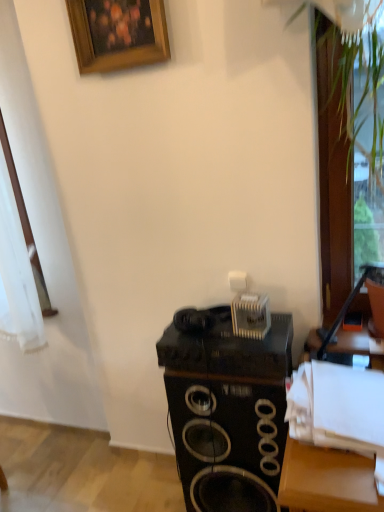
Question: Does black matte speaker at center come in front of wooden picture frame at upper center?

Choices:
 (A) no
 (B) yes

Answer: (B)

Question: From the image's perspective, would you say black matte speaker at center is shown under wooden picture frame at upper center?

Choices:
 (A) yes
 (B) no

Answer: (A)

Question: Is black matte speaker at center thinner than wooden picture frame at upper center?

Choices:
 (A) yes
 (B) no

Answer: (B)

Question: From the image's perspective, is black matte speaker at center on top of wooden picture frame at upper center?

Choices:
 (A) no
 (B) yes

Answer: (A)

Question: Considering the relative sizes of black matte speaker at center and wooden picture frame at upper center in the image provided, is black matte speaker at center bigger than wooden picture frame at upper center?

Choices:
 (A) no
 (B) yes

Answer: (B)

Question: Looking at their shapes, would you say transparent glass door at right is wider or thinner than black matte speaker at center?

Choices:
 (A) thin
 (B) wide

Answer: (A)

Question: In the image, is transparent glass door at right on the left side or the right side of black matte speaker at center?

Choices:
 (A) left
 (B) right

Answer: (B)

Question: Looking at the image, does transparent glass door at right seem bigger or smaller compared to black matte speaker at center?

Choices:
 (A) small
 (B) big

Answer: (A)

Question: From a real-world perspective, is transparent glass door at right above or below black matte speaker at center?

Choices:
 (A) below
 (B) above

Answer: (B)

Question: In terms of size, does black matte speaker at center appear bigger or smaller than wooden picture frame at upper center?

Choices:
 (A) small
 (B) big

Answer: (B)

Question: From a real-world perspective, relative to wooden picture frame at upper center, is black matte speaker at center vertically above or below?

Choices:
 (A) above
 (B) below

Answer: (B)

Question: Is black matte speaker at center in front of or behind wooden picture frame at upper center in the image?

Choices:
 (A) front
 (B) behind

Answer: (A)

Question: In terms of width, does black matte speaker at center look wider or thinner when compared to wooden picture frame at upper center?

Choices:
 (A) thin
 (B) wide

Answer: (B)

Question: From a real-world perspective, relative to transparent glass door at right, is black matte speaker at center vertically above or below?

Choices:
 (A) above
 (B) below

Answer: (B)

Question: In the image, is black matte speaker at center on the left side or the right side of transparent glass door at right?

Choices:
 (A) left
 (B) right

Answer: (A)